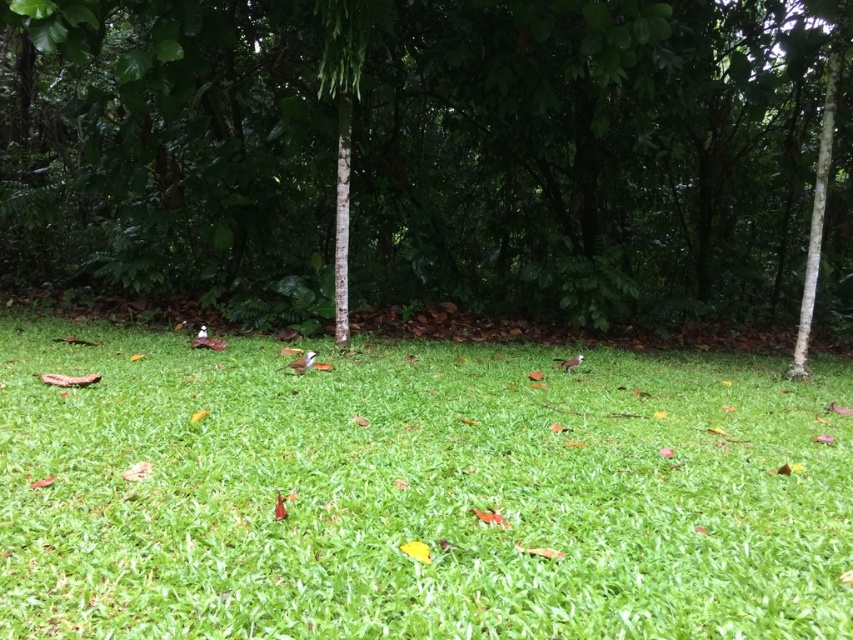
Who is positioned more to the left, green leafy tree at center or green grass at center?

Positioned to the left is green grass at center.

Which of these two, green leafy tree at center or green grass at center, stands taller?

With more height is green leafy tree at center.

Is point (770, 147) less distant than point (86, 595)?

No, (770, 147) is further to viewer.

At what (x,y) coordinates should I click in order to perform the action: click on green leafy tree at center. Please return your answer as a coordinate pair (x, y). Looking at the image, I should click on (444, 148).